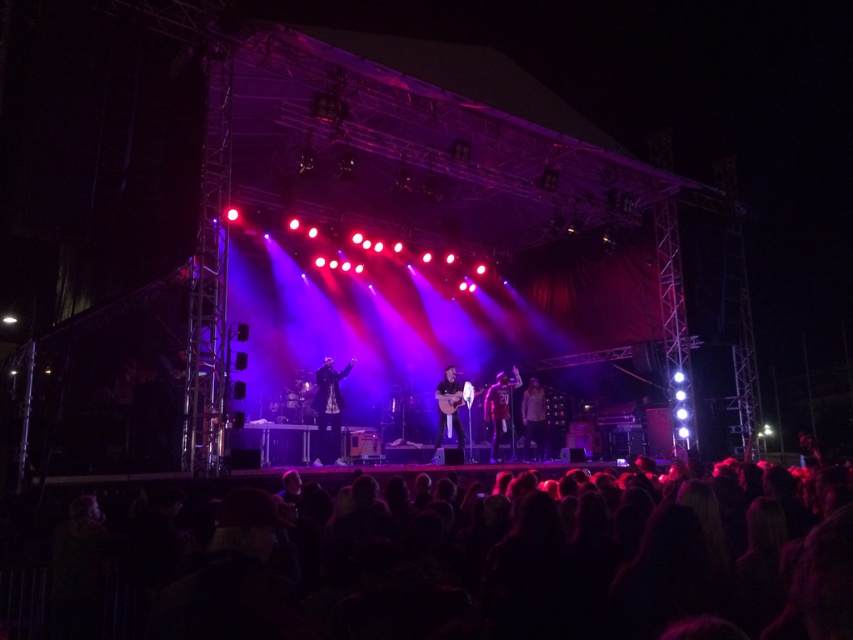
Question: Estimate the real-world distances between objects in this image. Which object is closer to the black velvet coat at center?

Choices:
 (A) shiny silver guitar at center
 (B) shiny metallic jacket at center
 (C) black hair at lower center

Answer: (A)

Question: Estimate the real-world distances between objects in this image. Which object is farther from the shiny silver guitar at center?

Choices:
 (A) matte red shirt at center
 (B) black hair at lower center
 (C) black velvet coat at center
 (D) shiny metallic jacket at center

Answer: (B)

Question: Observing the image, what is the correct spatial positioning of black hair at lower center in reference to black velvet coat at center?

Choices:
 (A) left
 (B) right

Answer: (B)

Question: Is matte red shirt at center closer to camera compared to shiny metallic jacket at center?

Choices:
 (A) no
 (B) yes

Answer: (B)

Question: Is black hair at lower center further to camera compared to shiny metallic jacket at center?

Choices:
 (A) no
 (B) yes

Answer: (A)

Question: Estimate the real-world distances between objects in this image. Which object is closer to the shiny metallic jacket at center?

Choices:
 (A) shiny silver guitar at center
 (B) black hair at lower center
 (C) black velvet coat at center

Answer: (A)